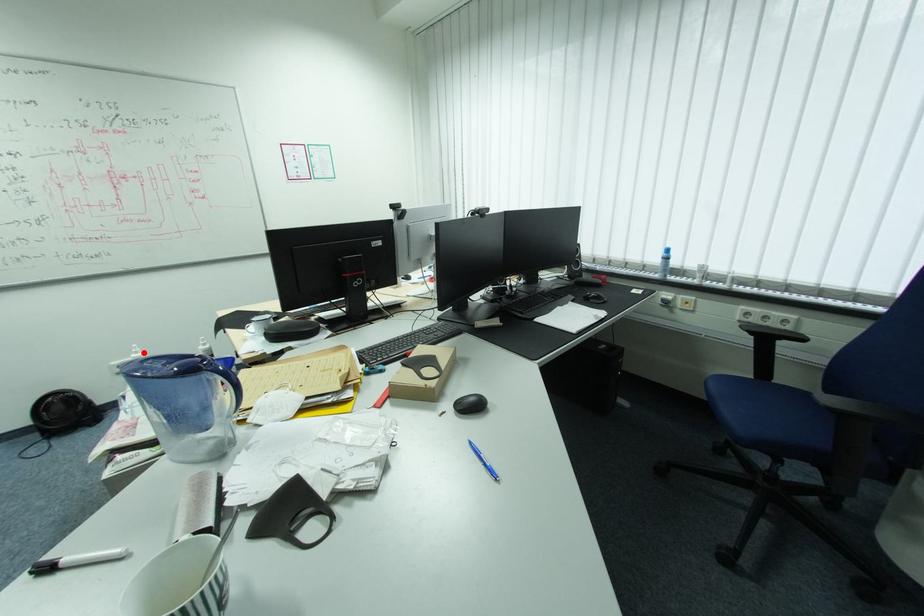
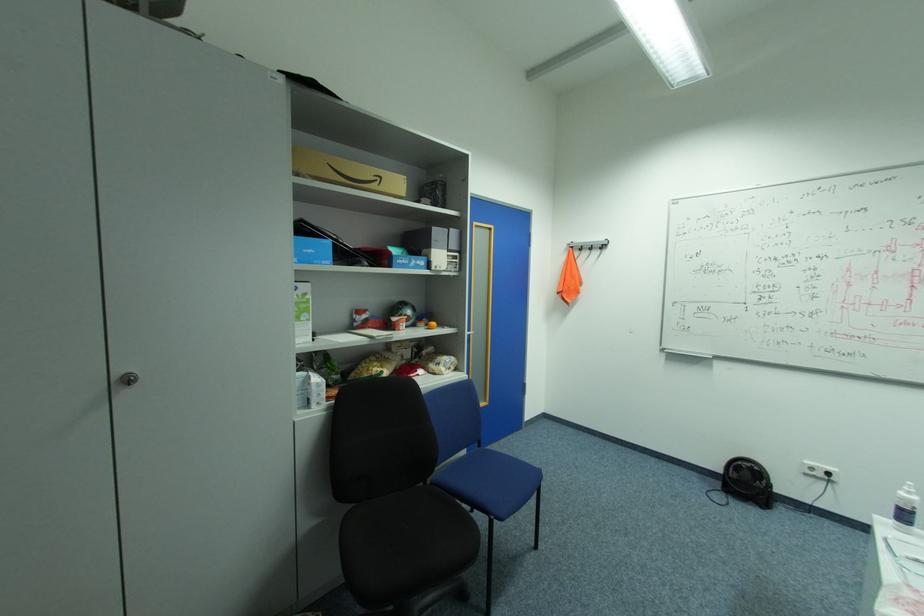
In the second image, find the point that corresponds to the highlighted location in the first image.

(916, 493)